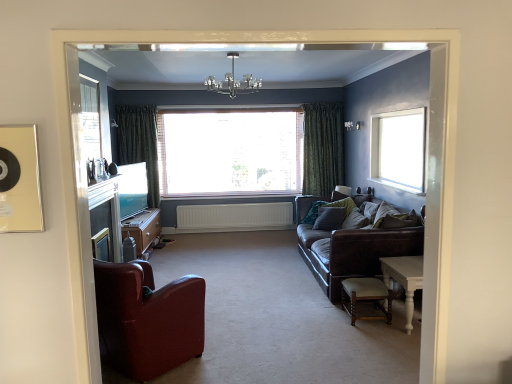
This screenshot has width=512, height=384. Identify the location of vacant area that lies between white wood table at lower right and leather armchair at left. (287, 344).